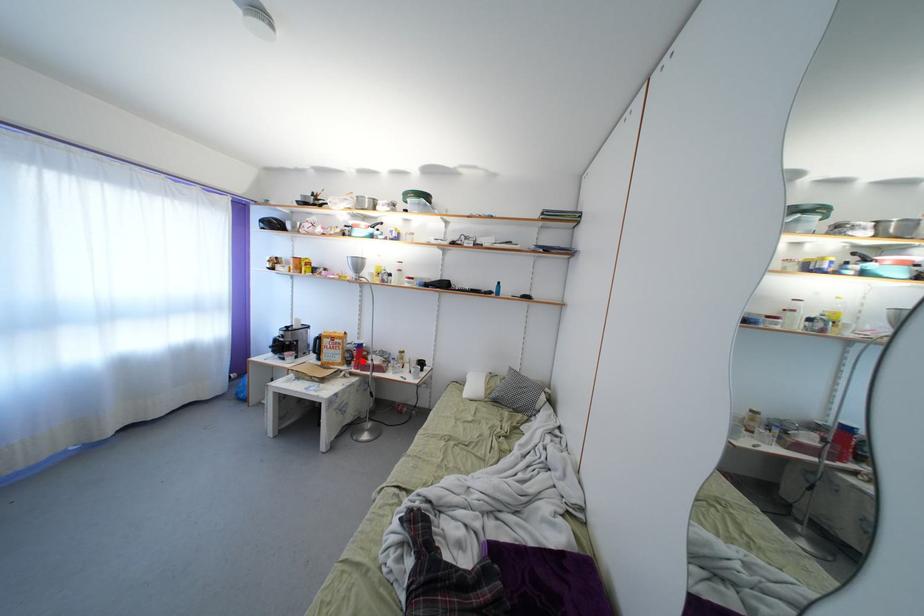
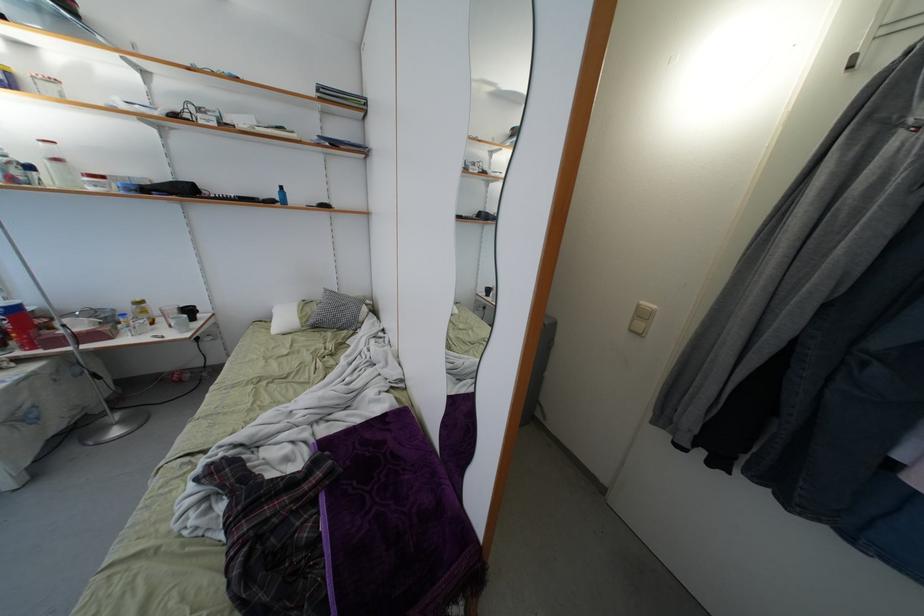
Question: I am providing you with two images of the same scene from different viewpoints. Image1 has a red point marked. In image2, the corresponding 3D location appears at what relative position? Reply with the corresponding letter.

Choices:
 (A) Closer
 (B) Farther

Answer: (B)